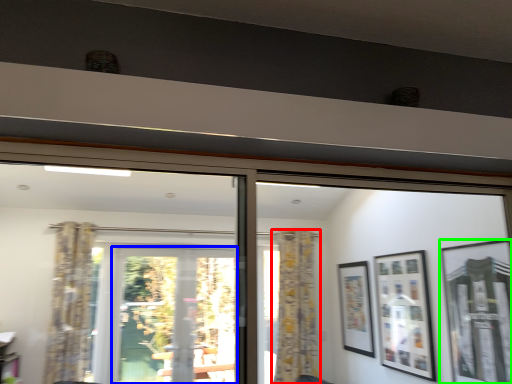
Question: Which object is positioned farthest from curtain (highlighted by a red box)? Select from screen door (highlighted by a blue box) and picture frame (highlighted by a green box).

Choices:
 (A) screen door
 (B) picture frame

Answer: (B)